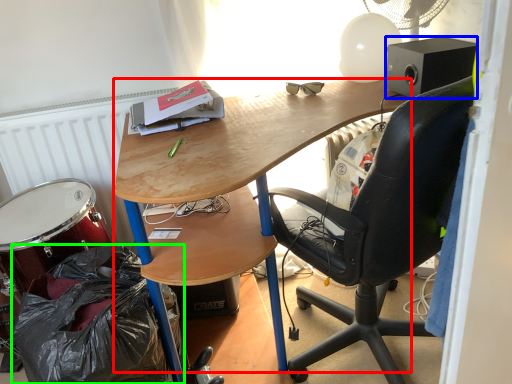
Question: Which object is the closest to the desk (highlighted by a red box)? Choose among these: loudspeaker (highlighted by a blue box) or garbage (highlighted by a green box).

Choices:
 (A) loudspeaker
 (B) garbage

Answer: (A)